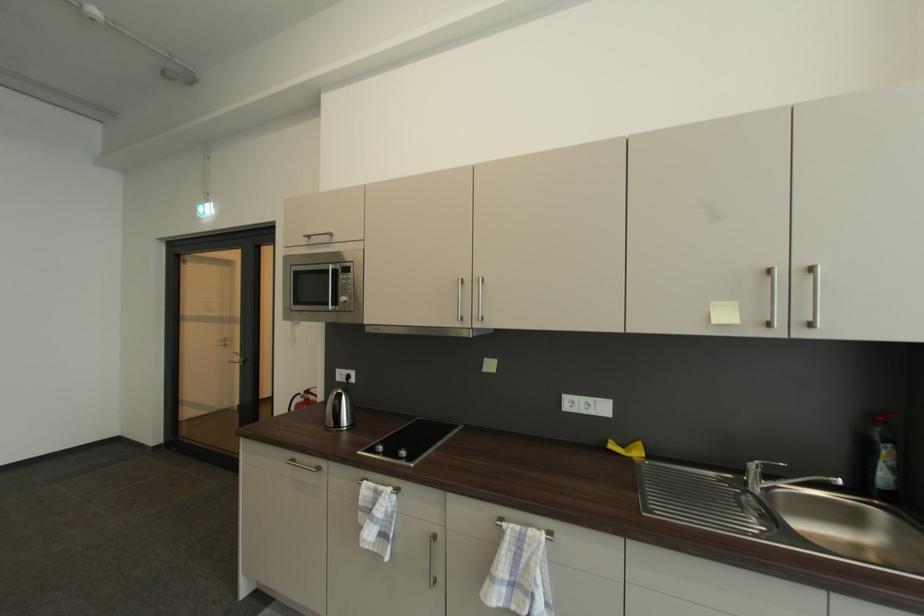
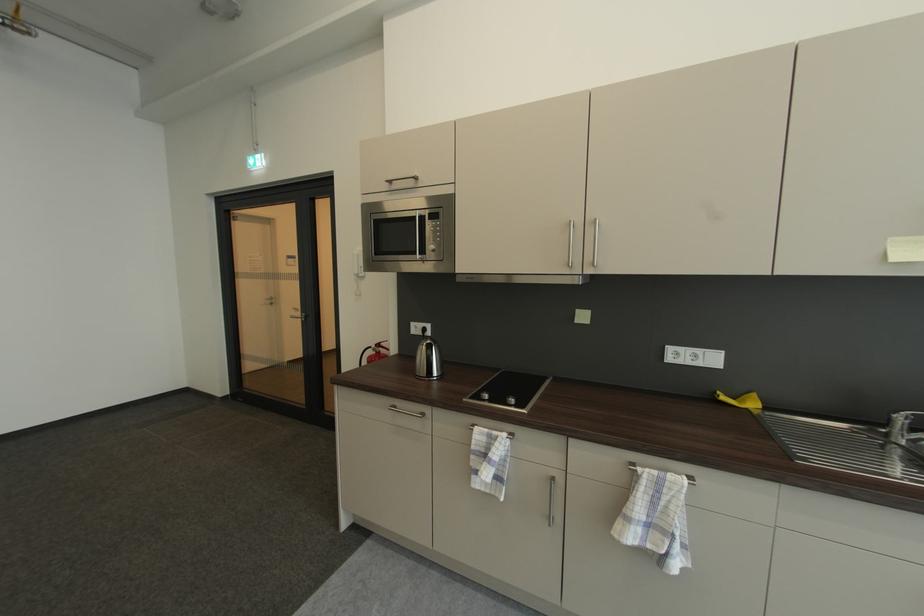
Locate, in the second image, the point that corresponds to [245,360] in the first image.

(305, 315)